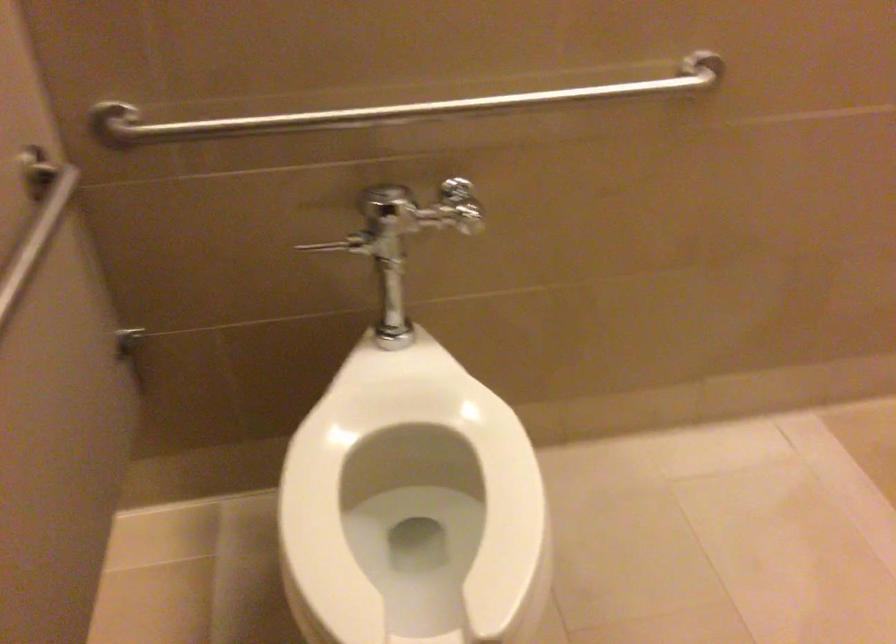
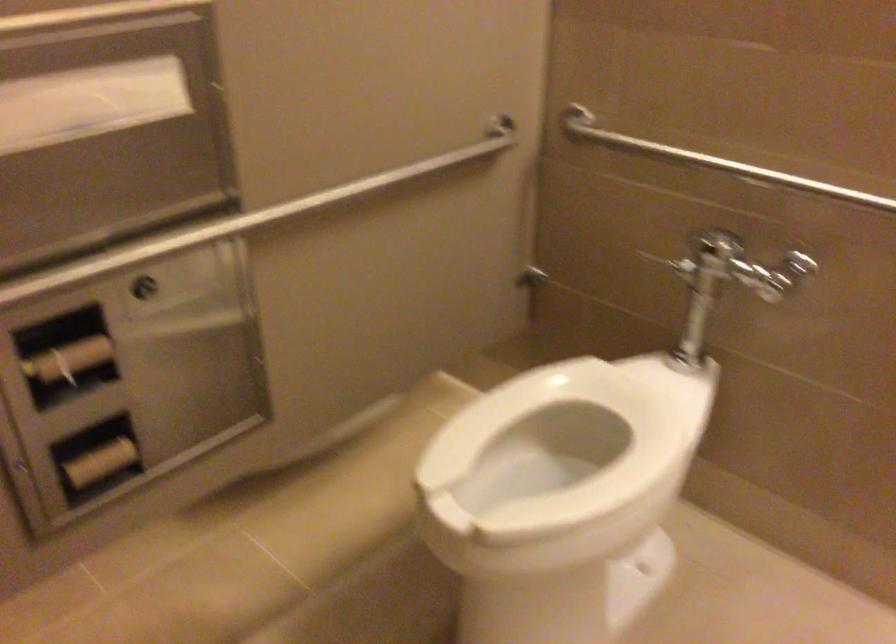
Where in the second image is the point corresponding to (389,222) from the first image?

(703, 260)